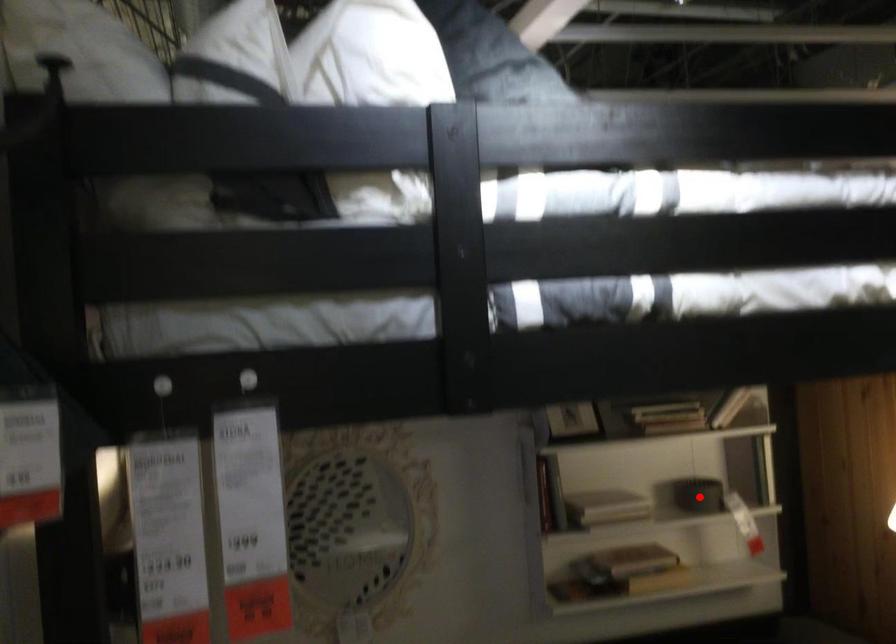
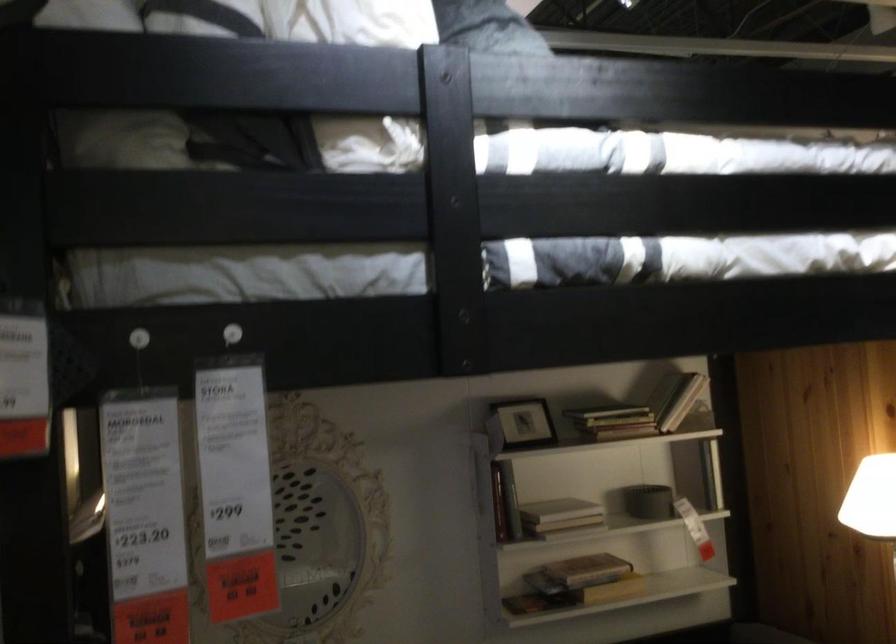
In the second image, find the point that corresponds to the highlighted location in the first image.

(648, 502)